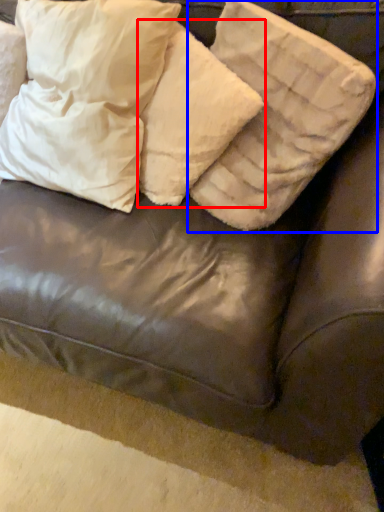
Question: Which object appears farthest to the camera in this image, pillow (highlighted by a red box) or pillow (highlighted by a blue box)?

Choices:
 (A) pillow
 (B) pillow

Answer: (A)